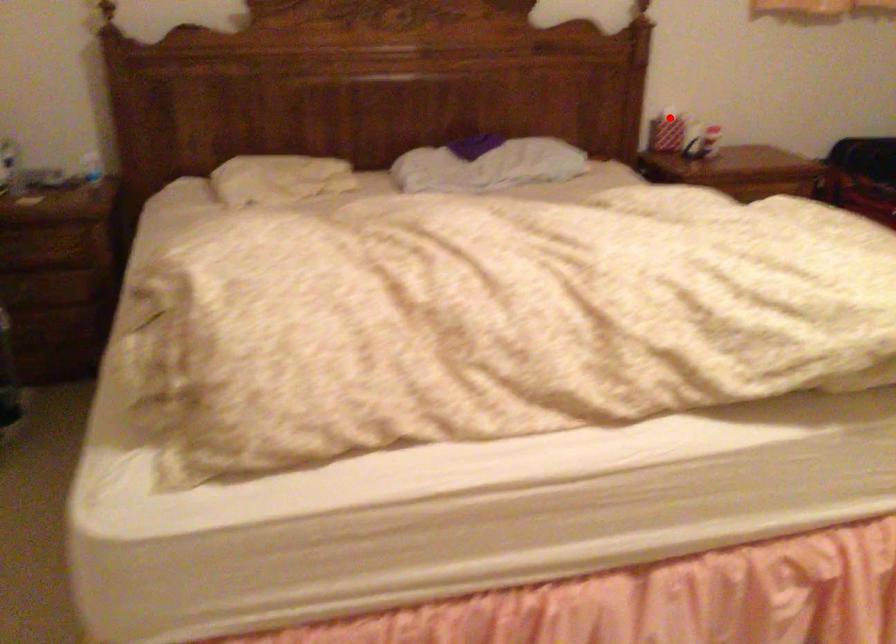
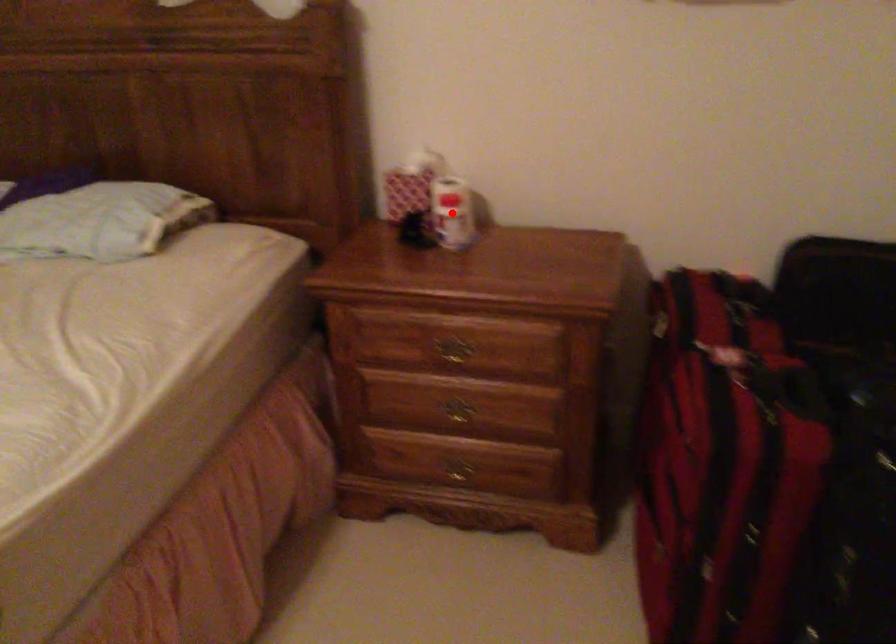
I am providing you with two images of the same scene from different viewpoints. A red point is marked on the first image and another point is marked on the second image. Are the points marked in image1 and image2 representing the same 3D position?

No